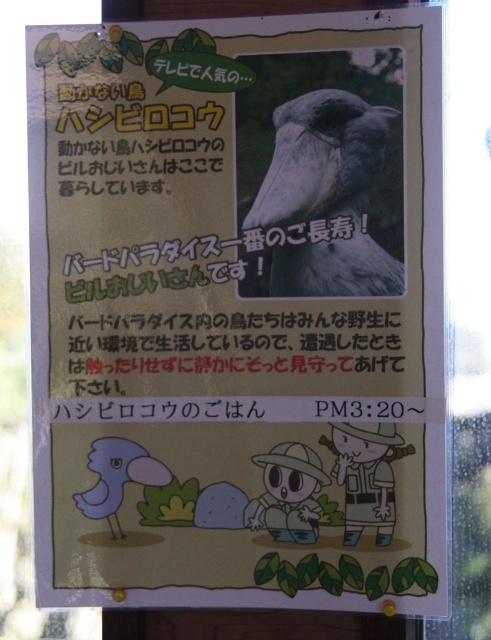
Can you confirm if gray matte bird at center is positioned to the left of matte blue bird at lower left?

Incorrect, gray matte bird at center is not on the left side of matte blue bird at lower left.

Which is behind, point (306, 285) or point (130, 452)?

Point (130, 452)

Who is more distant from viewer, (320, 104) or (146, 476)?

Positioned behind is point (146, 476).

Identify the location of gray matte bird at center. The image size is (491, 640). (322, 200).